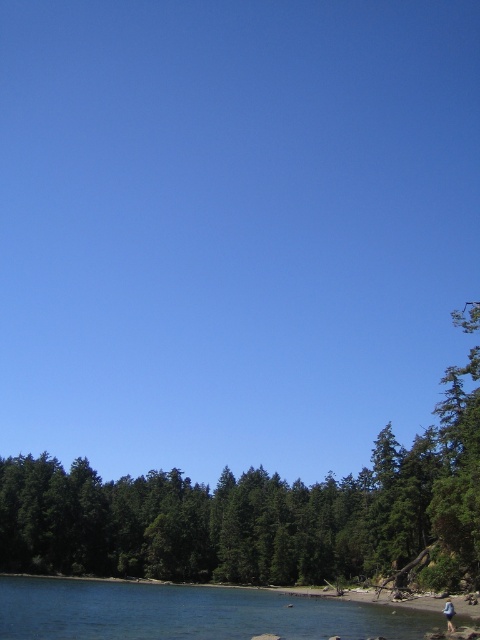
You are standing at the edge of the lake and see the green leafy tree at lower center and the blue denim jeans at lower right. Which object is closer to the water?

The green leafy tree at lower center is closer to the water because it is positioned below the blue denim jeans at lower right.